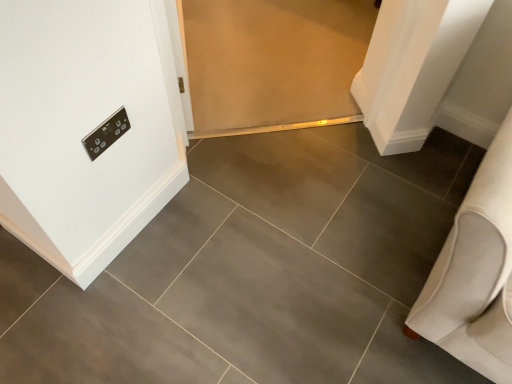
Question: Is white fabric sofa at right positioned far away from satin silver switch at upper left?

Choices:
 (A) yes
 (B) no

Answer: (B)

Question: Is white fabric sofa at right positioned before satin silver switch at upper left?

Choices:
 (A) no
 (B) yes

Answer: (B)

Question: Can you confirm if white fabric sofa at right is bigger than satin silver switch at upper left?

Choices:
 (A) no
 (B) yes

Answer: (B)

Question: Is white fabric sofa at right outside of satin silver switch at upper left?

Choices:
 (A) no
 (B) yes

Answer: (B)

Question: Is white fabric sofa at right taller than satin silver switch at upper left?

Choices:
 (A) no
 (B) yes

Answer: (B)

Question: Is white fabric sofa at right further to camera compared to satin silver switch at upper left?

Choices:
 (A) no
 (B) yes

Answer: (A)

Question: Is satin silver switch at upper left aimed at white fabric sofa at right?

Choices:
 (A) yes
 (B) no

Answer: (A)

Question: Are satin silver switch at upper left and white fabric sofa at right located far from each other?

Choices:
 (A) yes
 (B) no

Answer: (B)

Question: From the image's perspective, is satin silver switch at upper left on white fabric sofa at right?

Choices:
 (A) yes
 (B) no

Answer: (A)

Question: Is satin silver switch at upper left at the right side of white fabric sofa at right?

Choices:
 (A) no
 (B) yes

Answer: (A)

Question: Is satin silver switch at upper left touching white fabric sofa at right?

Choices:
 (A) yes
 (B) no

Answer: (B)

Question: Is satin silver switch at upper left at the left side of white fabric sofa at right?

Choices:
 (A) no
 (B) yes

Answer: (B)

Question: Considering their positions, is white fabric sofa at right located in front of or behind satin silver switch at upper left?

Choices:
 (A) behind
 (B) front

Answer: (B)